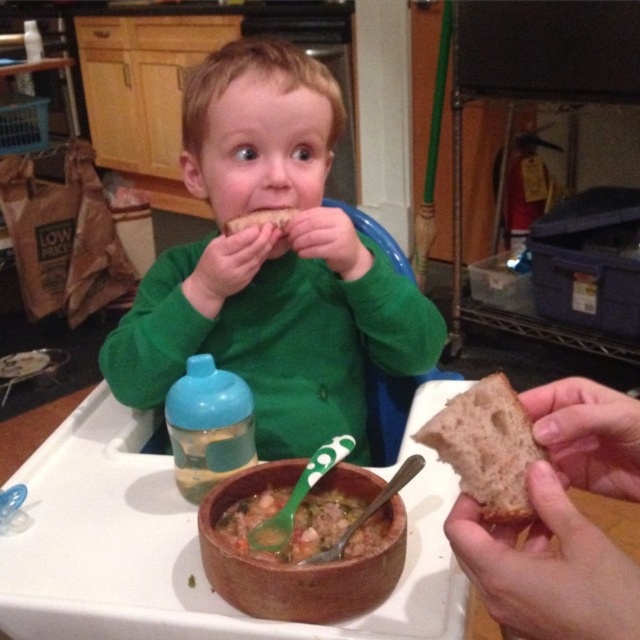
Question: Is blue plastic bottle at lower left above thick brown soup at center?

Choices:
 (A) no
 (B) yes

Answer: (B)

Question: Which point is closer to the camera?

Choices:
 (A) (465, 426)
 (B) (208, 490)

Answer: (A)

Question: Does brown matte bread at right come in front of thick brown soup at center?

Choices:
 (A) yes
 (B) no

Answer: (A)

Question: Which point appears farthest from the camera in this image?

Choices:
 (A) (304, 76)
 (B) (369, 499)
 (C) (284, 499)

Answer: (A)

Question: Which point is closer to the camera taking this photo?

Choices:
 (A) (484, 416)
 (B) (340, 602)

Answer: (A)

Question: Is green matte shirt at center to the right of brown matte bread at right from the viewer's perspective?

Choices:
 (A) yes
 (B) no

Answer: (B)